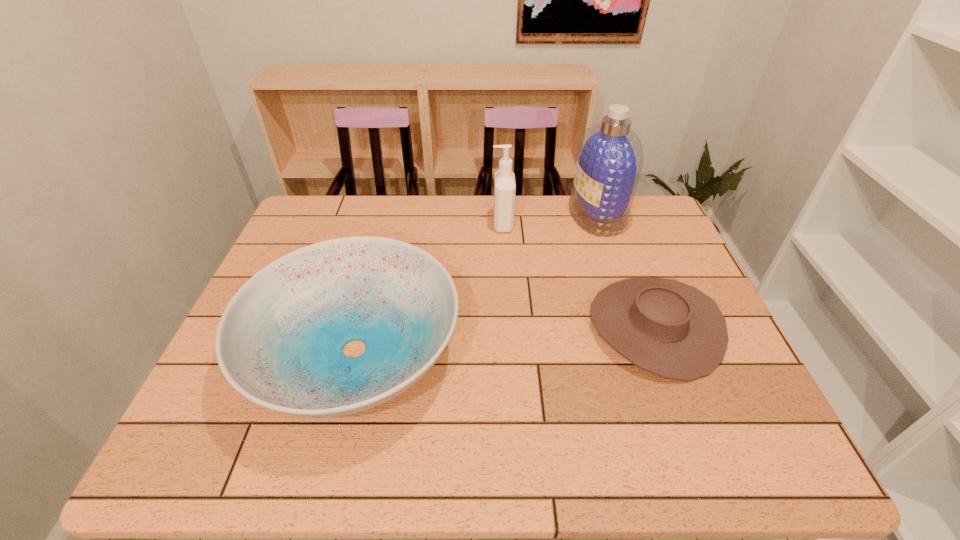
The image size is (960, 540). What are the coordinates of `free spot between the dish and the right cleansing agent` in the screenshot? It's located at (475, 283).

The image size is (960, 540). In order to click on free space between the third object from right to left and the shortest object in this screenshot , I will do `click(579, 275)`.

Where is `free spot between the taller cleansing agent and the second tallest object`? free spot between the taller cleansing agent and the second tallest object is located at coordinates (549, 220).

In order to click on object that is the third closest to the tallest object in this screenshot , I will do `click(279, 343)`.

Select which object is the second closest to the shorter cleansing agent. Please provide its 2D coordinates. Your answer should be formatted as a tuple, i.e. [(x, y)], where the tuple contains the x and y coordinates of a point satisfying the conditions above.

[(279, 343)]

Find the location of a particular element. vacant region that satisfies the following two spatial constraints: 1. on the front label of the shorter cleansing agent; 2. on the back side of the shortest object is located at coordinates (509, 327).

Locate an element on the screen. The image size is (960, 540). vacant point that satisfies the following two spatial constraints: 1. on the front label of the cowboy hat; 2. on the right side of the second object from left to right is located at coordinates (509, 327).

Image resolution: width=960 pixels, height=540 pixels. Find the location of `free space that satisfies the following two spatial constraints: 1. on the back side of the shortest object; 2. on the front label of the second tallest object`. free space that satisfies the following two spatial constraints: 1. on the back side of the shortest object; 2. on the front label of the second tallest object is located at coordinates (615, 224).